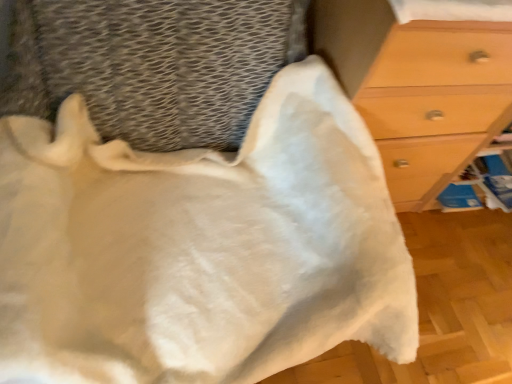
Question: Relative to white fluffy blanket at upper center, is matte wood chest of drawers at right in front or behind?

Choices:
 (A) behind
 (B) front

Answer: (A)

Question: From the image's perspective, is matte wood chest of drawers at right above or below white fluffy blanket at upper center?

Choices:
 (A) above
 (B) below

Answer: (A)

Question: Is matte wood chest of drawers at right spatially inside white fluffy blanket at upper center, or outside of it?

Choices:
 (A) outside
 (B) inside

Answer: (A)

Question: In the image, is white fluffy blanket at upper center positioned in front of or behind matte wood chest of drawers at right?

Choices:
 (A) behind
 (B) front

Answer: (B)

Question: Visually, is white fluffy blanket at upper center positioned to the left or to the right of matte wood chest of drawers at right?

Choices:
 (A) right
 (B) left

Answer: (B)

Question: Is point tap(219, 317) closer or farther from the camera than point tap(380, 105)?

Choices:
 (A) farther
 (B) closer

Answer: (B)

Question: From a real-world perspective, is white fluffy blanket at upper center physically located above or below matte wood chest of drawers at right?

Choices:
 (A) above
 (B) below

Answer: (A)